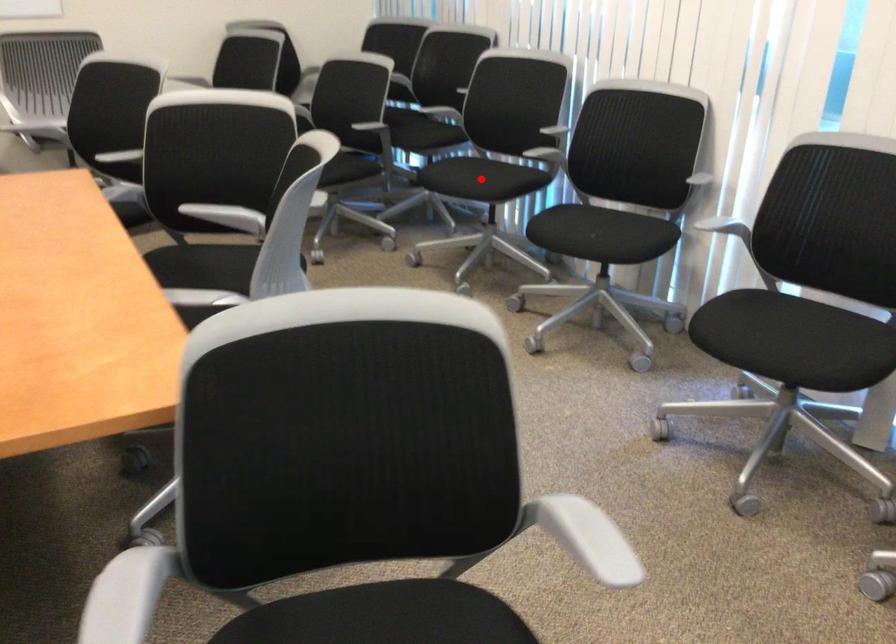
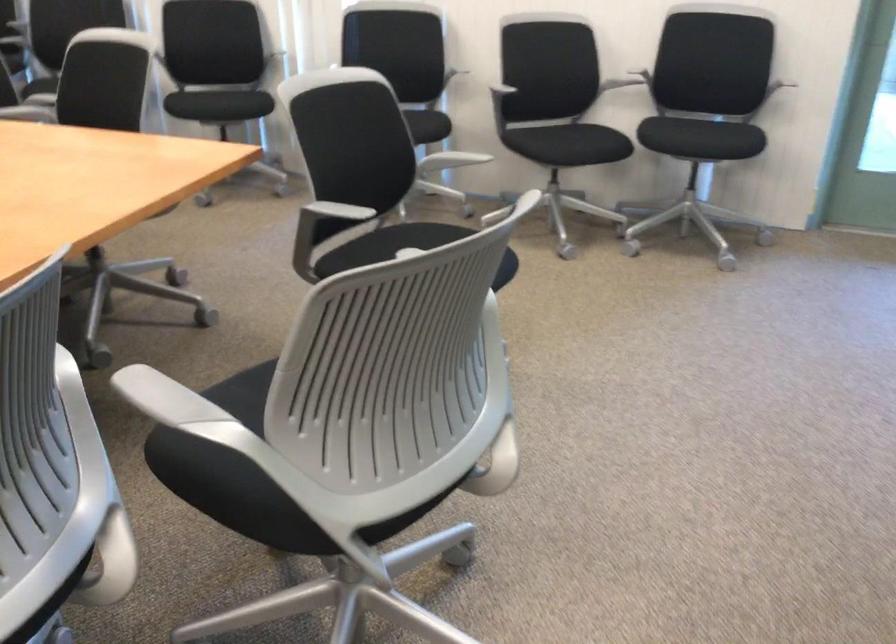
Question: I am providing you with two images of the same scene from different viewpoints. A red point is marked on the first image. Is the red point's position out of view in image 2?

Choices:
 (A) Yes
 (B) No

Answer: (A)